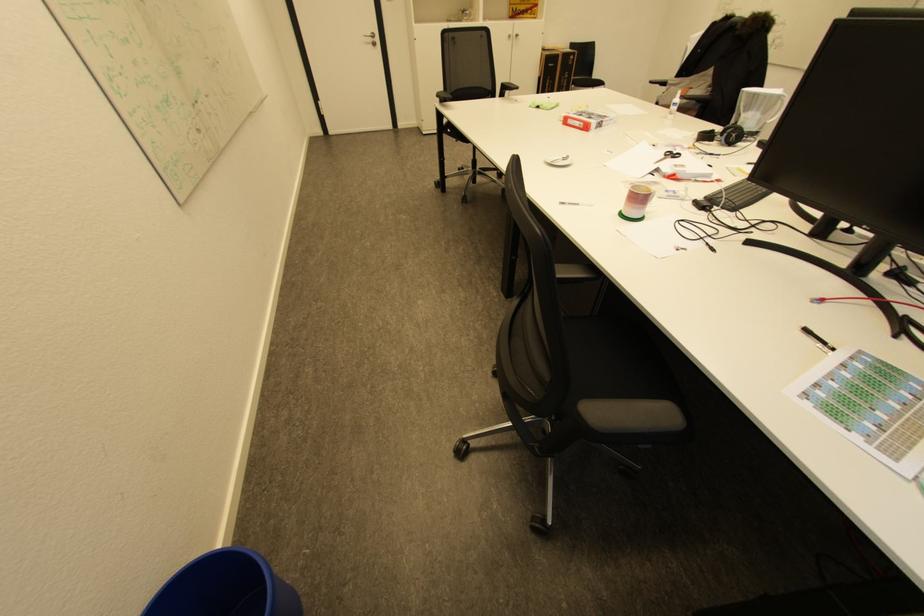
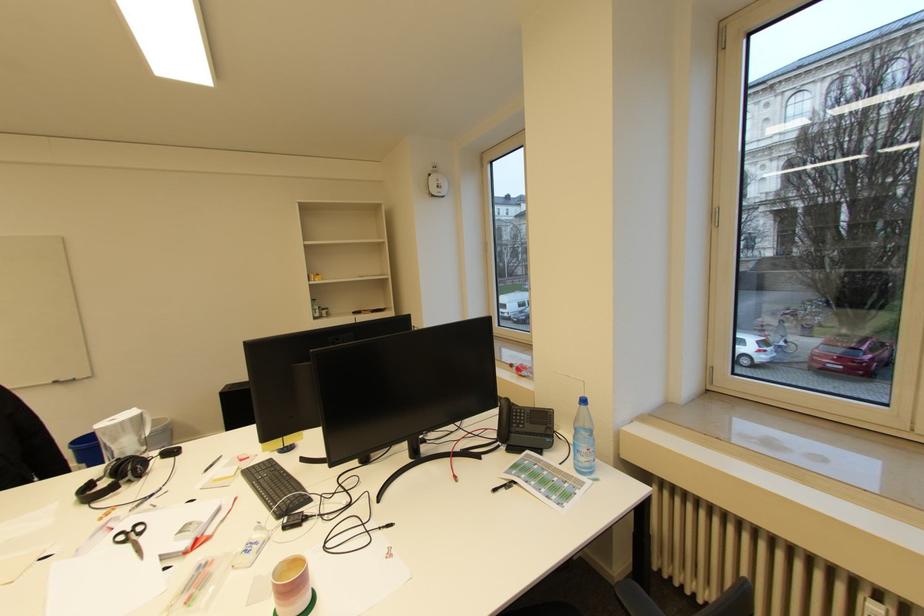
The first image is from the beginning of the video and the second image is from the end. How did the camera likely rotate when shooting the video?

The rotation direction of the camera is right-down.